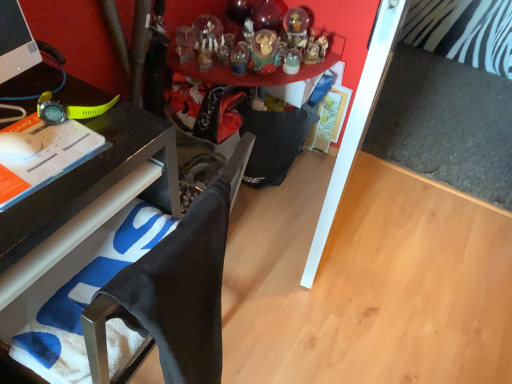
You are a GUI agent. You are given a task and a screenshot of the screen. Output one action in this format:
    pyautogui.click(x=<x>, y=<y>)
    Task: Click on the vacant area that lies in front of matte black watch at left
    The width and height of the screenshot is (512, 384).
    Given the screenshot: What is the action you would take?
    pyautogui.click(x=48, y=177)